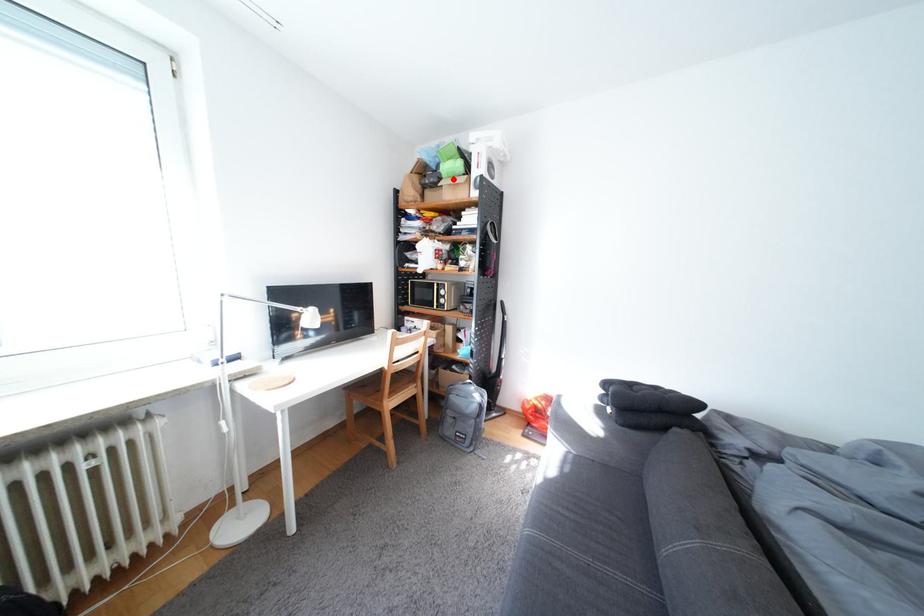
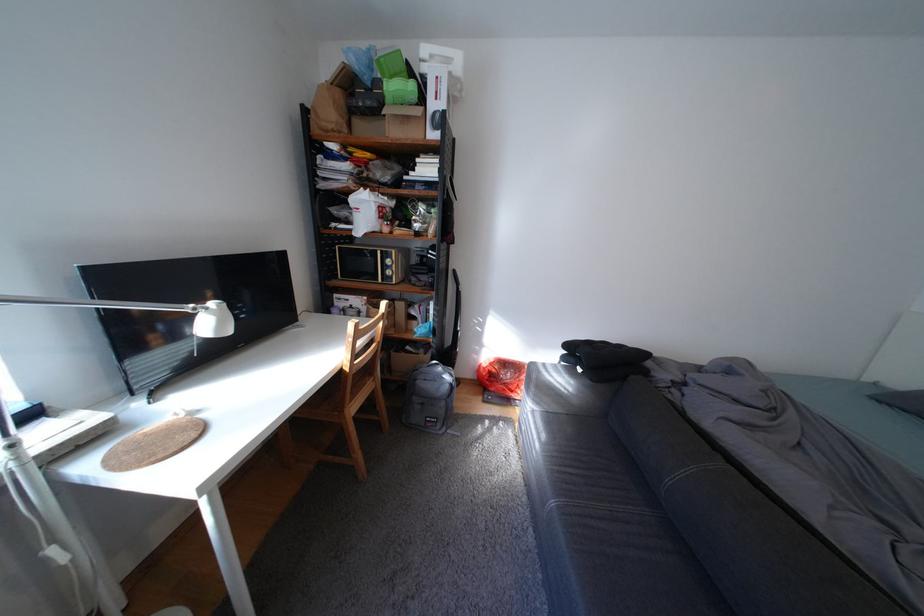
Find the pixel in the second image that matches the highlighted location in the first image.

(395, 103)